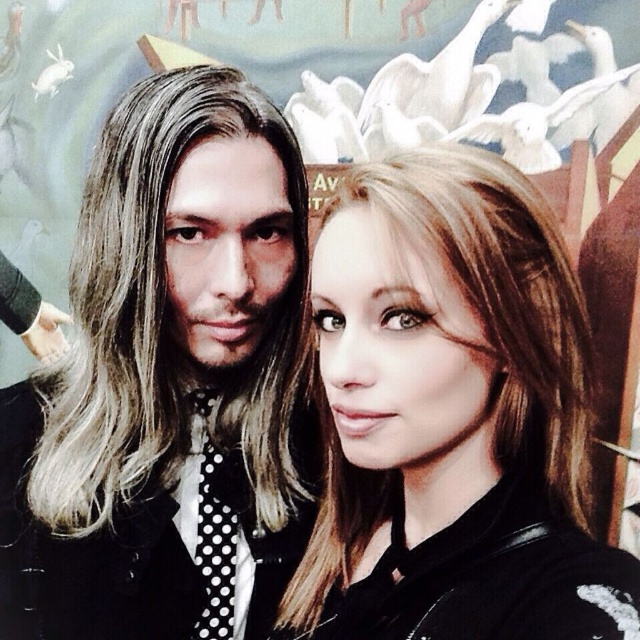
Which of these two, brown hair at center or black dotted fabric tie at left, stands taller?

With more height is brown hair at center.

Where is `brown hair at center`? This screenshot has height=640, width=640. brown hair at center is located at coordinates (452, 417).

Does point (480, 484) come behind point (236, 532)?

No, (480, 484) is closer to viewer.

You are a GUI agent. You are given a task and a screenshot of the screen. Output one action in this format:
    pyautogui.click(x=<x>, y=<y>)
    Task: Click on the brown hair at center
    The width and height of the screenshot is (640, 640).
    Given the screenshot: What is the action you would take?
    pyautogui.click(x=452, y=417)

Measure the distance between polka dot tie at center and brown hair at center.

polka dot tie at center and brown hair at center are 7.89 inches apart.

Is polka dot tie at center smaller than brown hair at center?

Actually, polka dot tie at center might be larger than brown hair at center.

At what (x,y) coordinates should I click in order to perform the action: click on polka dot tie at center. Please return your answer as a coordinate pair (x, y). The height and width of the screenshot is (640, 640). Looking at the image, I should click on (170, 384).

Is polka dot tie at center bigger than black dotted fabric tie at left?

Indeed, polka dot tie at center has a larger size compared to black dotted fabric tie at left.

This screenshot has width=640, height=640. What are the coordinates of `polka dot tie at center` in the screenshot? It's located at 170,384.